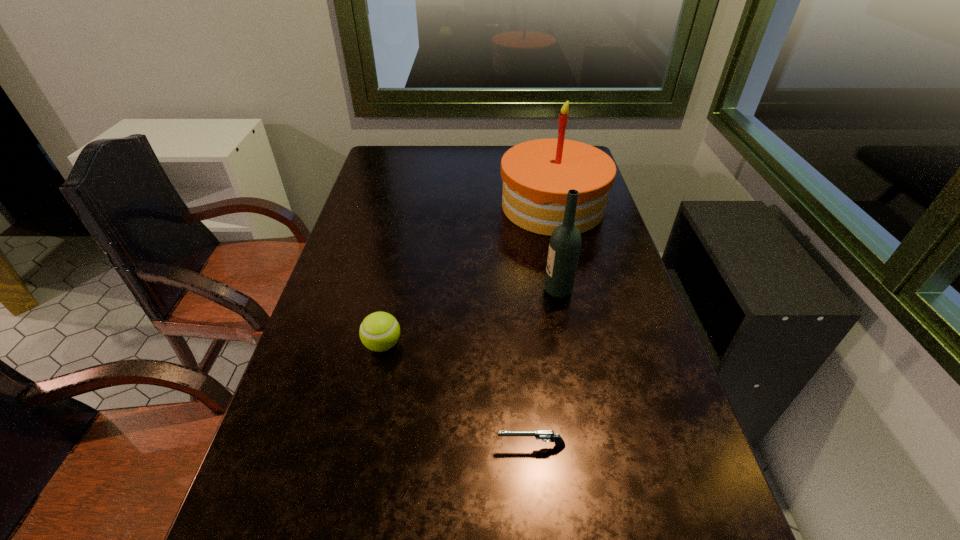
The width and height of the screenshot is (960, 540). Identify the location of vacant position located 0.100m on the labeled side of the second farthest object. (506, 291).

This screenshot has height=540, width=960. I want to click on free location located on the right of the second nearest object, so tap(433, 345).

I want to click on vacant region located 0.210m on the front-facing side of the shortest object, so click(x=387, y=446).

At what (x,y) coordinates should I click in order to perform the action: click on vacant space located 0.300m on the front-facing side of the shortest object. Please return your answer as a coordinate pair (x, y). Looking at the image, I should click on (340, 446).

Identify the location of free point located 0.310m on the front-facing side of the shortest object. (334, 446).

This screenshot has height=540, width=960. Identify the location of object present at the left edge. tap(379, 331).

This screenshot has height=540, width=960. What are the coordinates of `object that is at the right edge` in the screenshot? It's located at (537, 175).

The height and width of the screenshot is (540, 960). I want to click on free spot at the far edge of the desktop, so click(x=446, y=156).

Identify the location of vacant region at the left edge. Image resolution: width=960 pixels, height=540 pixels. (327, 474).

Identify the location of vacant space at the right edge of the desktop. (592, 321).